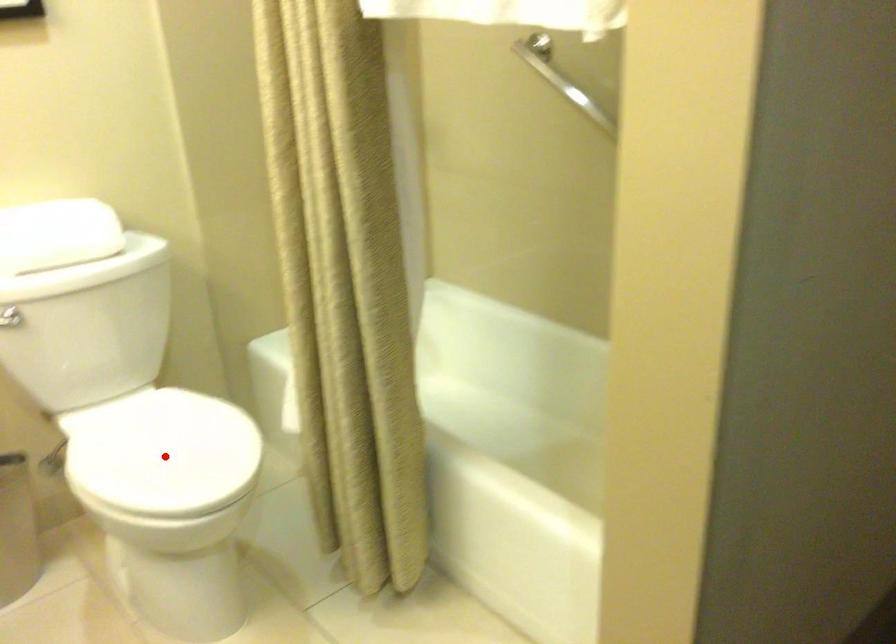
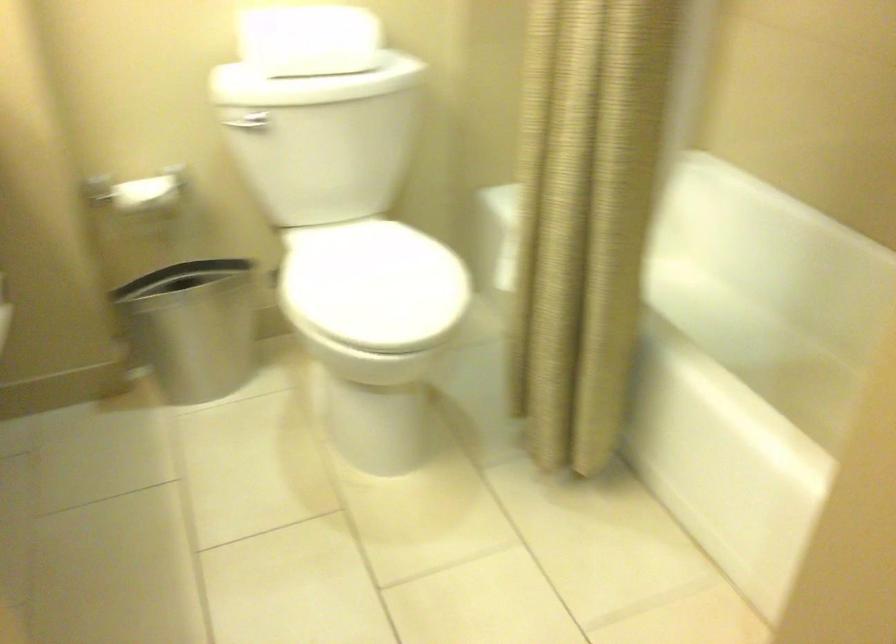
In the second image, find the point that corresponds to the highlighted location in the first image.

(372, 285)